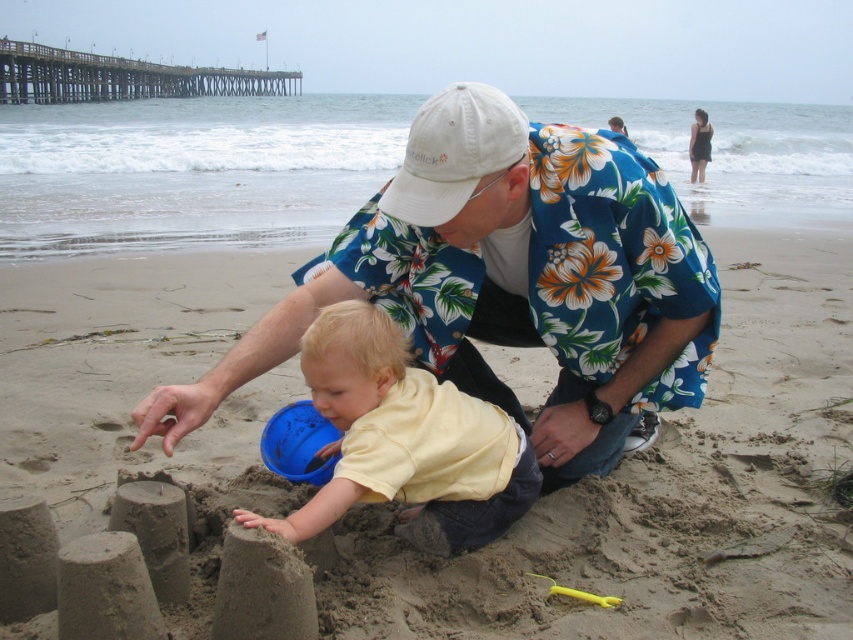
Is the position of smooth sandcastle at center more distant than that of yellow plastic shovel at lower center?

Yes, smooth sandcastle at center is further from the viewer.

Who is more forward, (692, 554) or (575, 596)?

Point (575, 596)

This screenshot has width=853, height=640. I want to click on smooth sandcastle at center, so click(670, 493).

In order to click on smooth sandcastle at center in this screenshot , I will do `click(670, 493)`.

Does point (460, 90) lie in front of point (297, 428)?

Yes, it is.

Does white cotton baseball cap at center come behind blue plastic bucket at center?

No, white cotton baseball cap at center is in front of blue plastic bucket at center.

Is point (514, 132) positioned in front of point (312, 412)?

Yes, it is.

Identify the location of white cotton baseball cap at center. Image resolution: width=853 pixels, height=640 pixels. (454, 152).

Can you confirm if smooth sandcastle at center is shorter than blue plastic bucket at center?

Indeed, smooth sandcastle at center has a lesser height compared to blue plastic bucket at center.

Which of these two, smooth sandcastle at center or blue plastic bucket at center, stands taller?

With more height is blue plastic bucket at center.

Find the location of `smooth sandcastle at center`. smooth sandcastle at center is located at coordinates (670, 493).